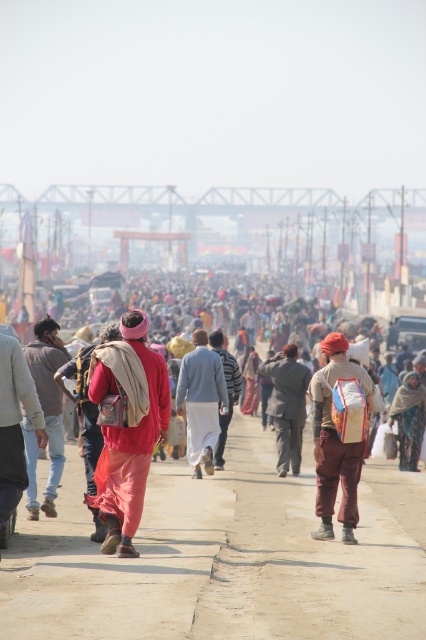
Question: Considering the relative positions of light brown dirt road at center and dark gray fabric coat at center in the image provided, where is light brown dirt road at center located with respect to dark gray fabric coat at center?

Choices:
 (A) left
 (B) right

Answer: (A)

Question: Which object is closer to the camera taking this photo?

Choices:
 (A) matte red cloth at center
 (B) matte red backpack at center
 (C) dark gray fabric coat at center

Answer: (A)

Question: Based on their relative distances, which object is farther from the red cotton pants at center?

Choices:
 (A) light brown dirt road at center
 (B) jeans at left
 (C) matte pink pants at center
 (D) camouflage fabric bag at center

Answer: (B)

Question: Among these points, which one is nearest to the camera?

Choices:
 (A) (149, 422)
 (B) (276, 381)
 (C) (348, 618)
 (D) (43, 440)

Answer: (C)

Question: Is jeans at left to the right of dark gray fabric coat at center from the viewer's perspective?

Choices:
 (A) no
 (B) yes

Answer: (A)

Question: Is matte red backpack at center above jeans at left?

Choices:
 (A) no
 (B) yes

Answer: (B)